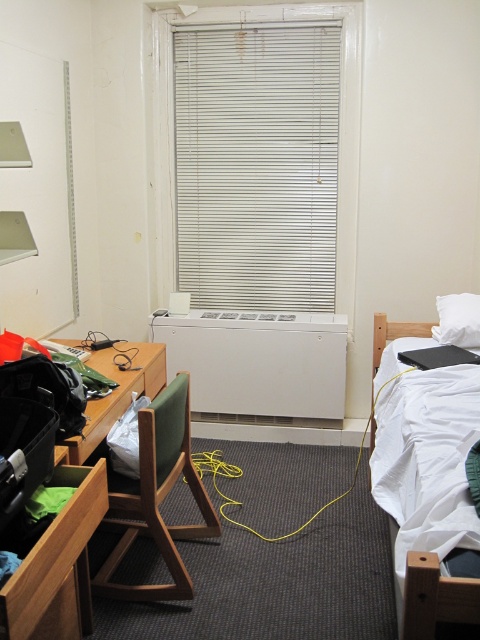
Can you confirm if white matte blinds at center is bigger than wooden chair at center?

Indeed, white matte blinds at center has a larger size compared to wooden chair at center.

Can you confirm if white matte blinds at center is shorter than wooden chair at center?

Incorrect, white matte blinds at center's height does not fall short of wooden chair at center's.

Which is in front, point (300, 236) or point (156, 545)?

Positioned in front is point (156, 545).

Identify the location of white matte blinds at center. (256, 164).

Who is higher up, white soft pillow at upper right or wooden drawer at center?

Positioned higher is white soft pillow at upper right.

Who is shorter, white soft pillow at upper right or wooden drawer at center?

With less height is wooden drawer at center.

Locate an element on the screen. white soft pillow at upper right is located at coordinates (457, 320).

Which is behind, point (203, 109) or point (156, 369)?

The point (203, 109) is behind.

Is white matte blinds at center smaller than wooden drawer at center?

No, white matte blinds at center is not smaller than wooden drawer at center.

The width and height of the screenshot is (480, 640). What do you see at coordinates (256, 164) in the screenshot? I see `white matte blinds at center` at bounding box center [256, 164].

Find the location of a particular element. white matte blinds at center is located at coordinates (256, 164).